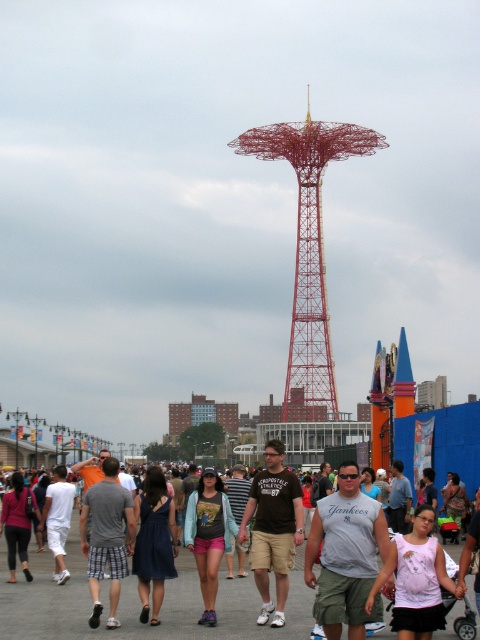
Is point (335, 404) behind point (396, 552)?

Yes, it is behind point (396, 552).

Is red metal structure at center thinner than pink cotton tank top at center?

No.

Is point (303, 166) behind point (395, 627)?

Yes, point (303, 166) is farther from viewer.

Identify the location of red metal structure at center. (x=309, y=252).

Can you confirm if matte black tank top at center is shorter than brown cotton t-shirt at center?

Correct, matte black tank top at center is not as tall as brown cotton t-shirt at center.

The width and height of the screenshot is (480, 640). Identify the location of matte black tank top at center. (140, 604).

Between brown cotton t-shirt at center and pink cotton tank top at center, which one appears on the right side from the viewer's perspective?

Positioned to the right is pink cotton tank top at center.

Does brown cotton t-shirt at center have a greater width compared to pink cotton tank top at center?

No.

Locate an element on the screen. brown cotton t-shirt at center is located at coordinates (274, 529).